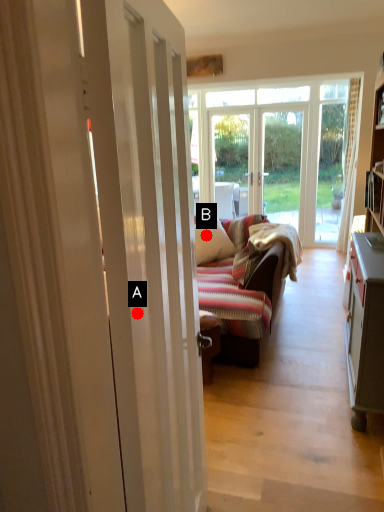
Question: Two points are circled on the image, labeled by A and B beside each circle. Among these points, which one is farthest from the camera?

Choices:
 (A) A is further
 (B) B is further

Answer: (B)